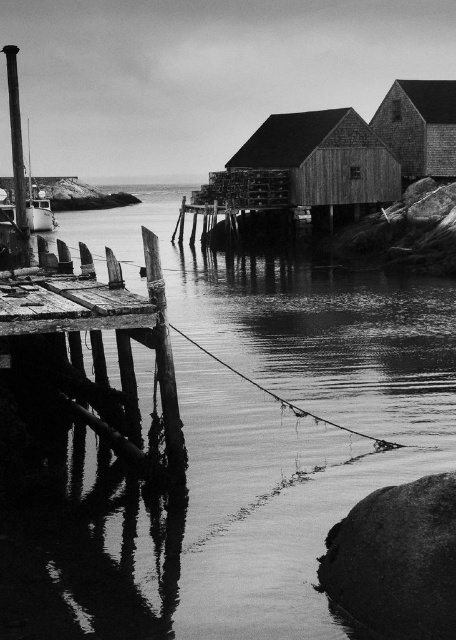
You are standing on the wooden dock and want to take a photo of both the reflective wet wood at lower left and the wooden cabin at upper right. Which object should you focus on first to ensure both are in sharp focus?

You should focus on the wooden cabin at upper right first because it is farther away than the reflective wet wood at lower left, allowing the camera to capture both within the depth of field.

You are standing on the wooden dock and notice two objects in the scene. One is the reflective wet wood at lower left and the other is the smooth wood pole at left. Which object is located to the right of the other?

The reflective wet wood at lower left is positioned on the right side of smooth wood pole at left, so the reflective wet wood at lower left is to the right of the smooth wood pole at left.